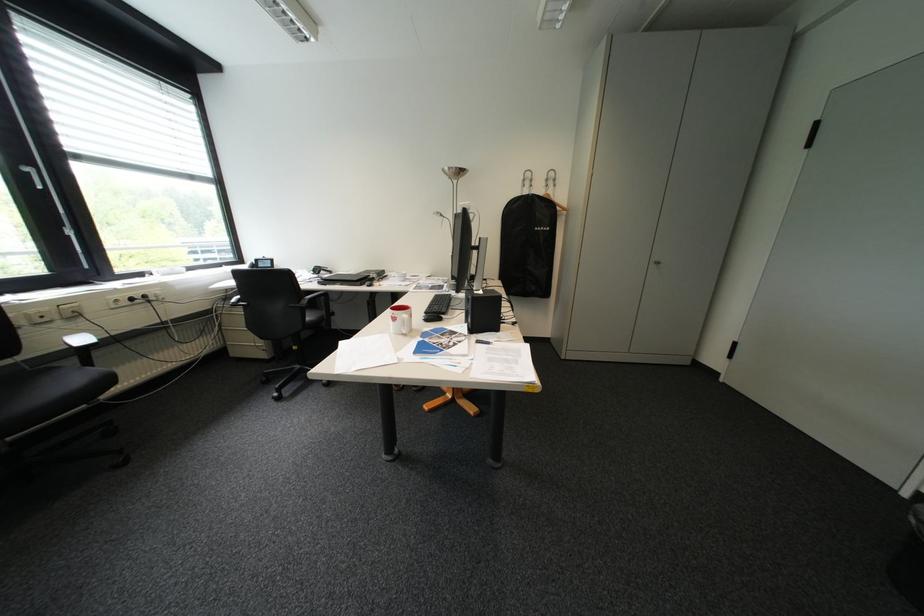
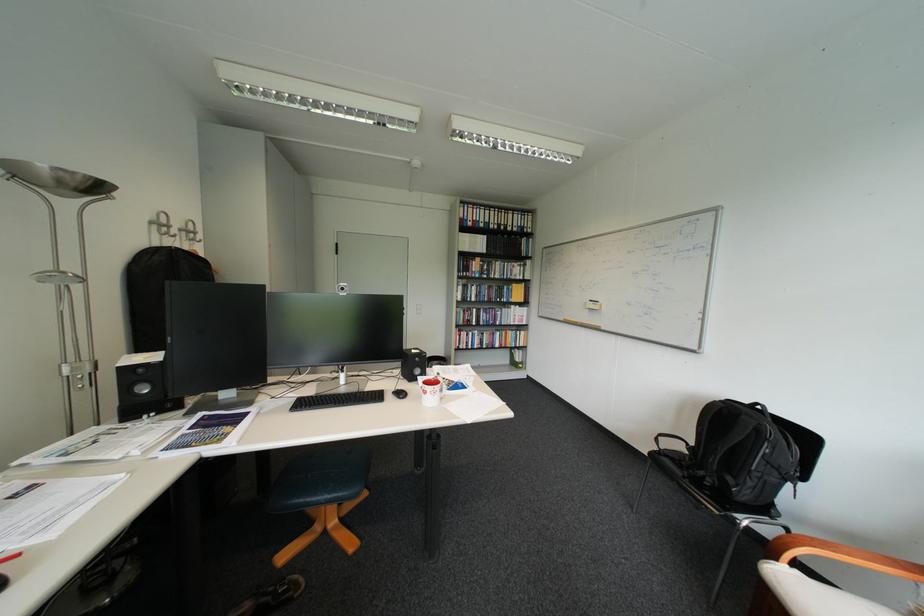
Where in the second image is the point corresponding to (x=543, y=187) from the first image?

(187, 237)